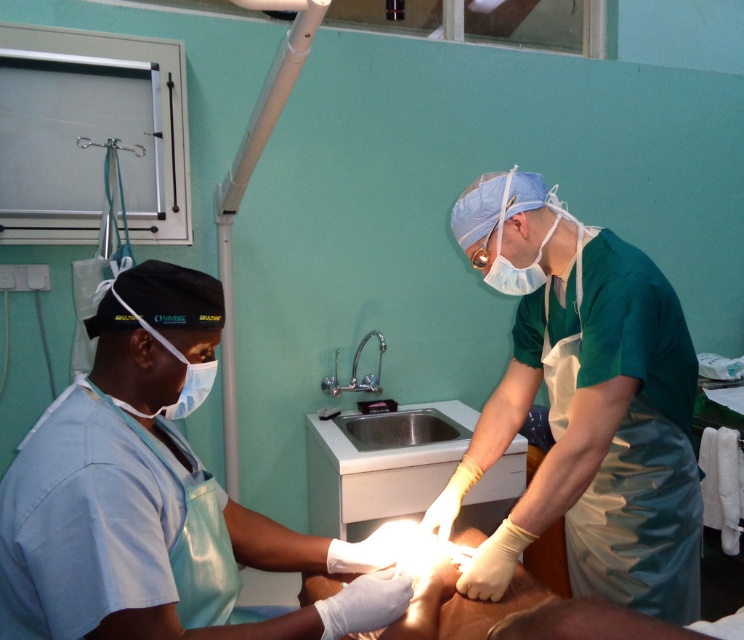
Please provide the coordinates of the blue surgical gown at center in the image. The coordinates should be in the format of a point with two decimal places, such as 0.5,0.5.

The coordinates of the blue surgical gown at center are at point (150,496).